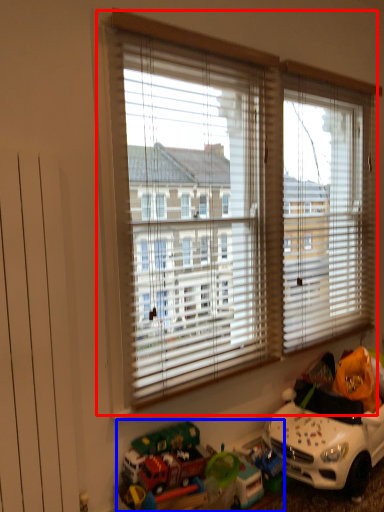
Question: Among these objects, which one is nearest to the camera, window (highlighted by a red box) or toy (highlighted by a blue box)?

Choices:
 (A) window
 (B) toy

Answer: (B)